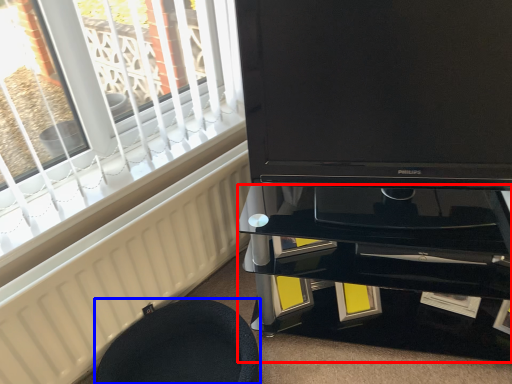
Question: Which object appears farthest to the camera in this image, tv cabinet (highlighted by a red box) or furniture (highlighted by a blue box)?

Choices:
 (A) tv cabinet
 (B) furniture

Answer: (A)